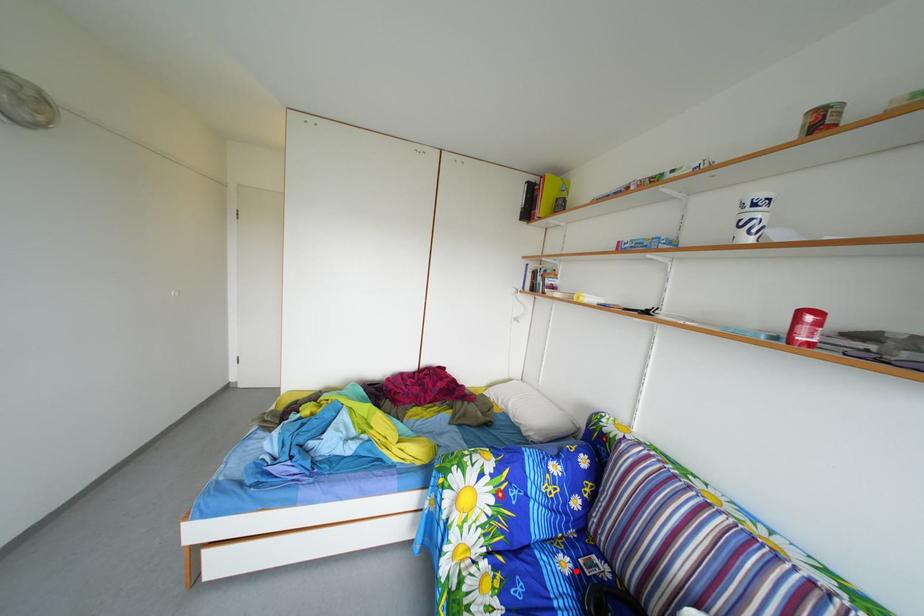
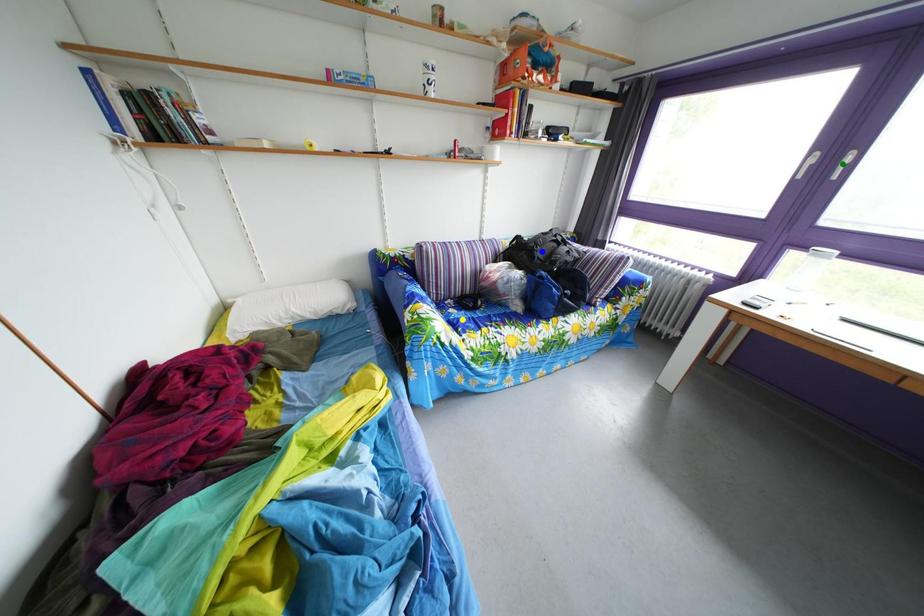
Question: I am providing you with two images of the same scene from different viewpoints. A red point is marked on the first image. You are given multiple points on the second image. In image 2, which mark is for the same physical point as the one in image 1?

Choices:
 (A) yellow point
 (B) green point
 (C) blue point

Answer: (A)